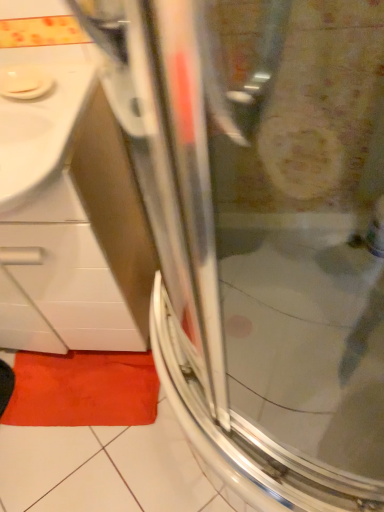
In order to click on orange fabric bath mat at lower left in this screenshot , I will do `click(83, 389)`.

What is the approximate height of orange fabric bath mat at lower left?

It is 1.93 inches.

Describe the element at coordinates (83, 389) in the screenshot. I see `orange fabric bath mat at lower left` at that location.

Describe the element at coordinates (39, 113) in the screenshot. Image resolution: width=384 pixels, height=512 pixels. I see `white glossy sink at upper left` at that location.

This screenshot has height=512, width=384. Identify the location of white glossy sink at upper left. (39, 113).

From the picture: In order to face white glossy sink at upper left, should I rotate leftwards or rightwards?

To face it directly, rotate left by 23.871 degrees.

Where is `orange fabric bath mat at lower left`? orange fabric bath mat at lower left is located at coordinates pyautogui.click(x=83, y=389).

Considering the relative positions of orange fabric bath mat at lower left and white glossy sink at upper left in the image provided, is orange fabric bath mat at lower left to the left or to the right of white glossy sink at upper left?

orange fabric bath mat at lower left is to the right of white glossy sink at upper left.

Is orange fabric bath mat at lower left in front of white glossy sink at upper left?

No, orange fabric bath mat at lower left is further to the viewer.

Is point (49, 393) behind point (58, 133)?

Yes, point (49, 393) is farther from viewer.

From the image's perspective, does orange fabric bath mat at lower left appear higher than white glossy sink at upper left?

No, from the image's perspective, orange fabric bath mat at lower left is not on top of white glossy sink at upper left.

From a real-world perspective, is orange fabric bath mat at lower left over white glossy sink at upper left?

No.

From the picture: Is orange fabric bath mat at lower left wider than white glossy sink at upper left?

In fact, orange fabric bath mat at lower left might be narrower than white glossy sink at upper left.

Between orange fabric bath mat at lower left and white glossy sink at upper left, which one has more height?

white glossy sink at upper left.

Which of these two, orange fabric bath mat at lower left or white glossy sink at upper left, is smaller?

Smaller between the two is orange fabric bath mat at lower left.

Consider the image. Is orange fabric bath mat at lower left spatially inside white glossy sink at upper left, or outside of it?

orange fabric bath mat at lower left exists outside the volume of white glossy sink at upper left.

Is orange fabric bath mat at lower left positioned far away from white glossy sink at upper left?

No.

In the scene shown: Is orange fabric bath mat at lower left facing away from white glossy sink at upper left?

No.

Can you tell me how much orange fabric bath mat at lower left and white glossy sink at upper left differ in facing direction?

4.72 degrees.

Image resolution: width=384 pixels, height=512 pixels. I want to click on sink above the orange fabric bath mat at lower left (from the image's perspective), so click(x=39, y=113).

Would you say white glossy sink at upper left is to the left or to the right of orange fabric bath mat at lower left in the picture?

Clearly, white glossy sink at upper left is on the left of orange fabric bath mat at lower left in the image.

In the scene shown: Between white glossy sink at upper left and orange fabric bath mat at lower left, which one is positioned behind?

orange fabric bath mat at lower left.

Considering the positions of points (53, 53) and (114, 408), is point (53, 53) closer to camera compared to point (114, 408)?

Yes, point (53, 53) is closer to viewer.

From the image's perspective, which is above, white glossy sink at upper left or orange fabric bath mat at lower left?

white glossy sink at upper left.

From a real-world perspective, relative to orange fabric bath mat at lower left, is white glossy sink at upper left vertically above or below?

From a real-world perspective, white glossy sink at upper left is physically above orange fabric bath mat at lower left.

Considering the sizes of objects white glossy sink at upper left and orange fabric bath mat at lower left in the image provided, who is wider, white glossy sink at upper left or orange fabric bath mat at lower left?

With larger width is white glossy sink at upper left.

Can you confirm if white glossy sink at upper left is shorter than orange fabric bath mat at lower left?

No, white glossy sink at upper left is not shorter than orange fabric bath mat at lower left.

Considering the relative sizes of white glossy sink at upper left and orange fabric bath mat at lower left in the image provided, is white glossy sink at upper left bigger than orange fabric bath mat at lower left?

Indeed, white glossy sink at upper left has a larger size compared to orange fabric bath mat at lower left.

Is white glossy sink at upper left situated inside orange fabric bath mat at lower left or outside?

white glossy sink at upper left lies outside orange fabric bath mat at lower left.

Is white glossy sink at upper left beside orange fabric bath mat at lower left?

No.

Could you tell me if white glossy sink at upper left is turned towards orange fabric bath mat at lower left?

No, white glossy sink at upper left does not turn towards orange fabric bath mat at lower left.

How many degrees apart are the facing directions of white glossy sink at upper left and orange fabric bath mat at lower left?

4.72 degrees.

Find the location of a particular element. The width and height of the screenshot is (384, 512). bath mat on the right of white glossy sink at upper left is located at coordinates (83, 389).

At what (x,y) coordinates should I click in order to perform the action: click on sink in front of the orange fabric bath mat at lower left. Please return your answer as a coordinate pair (x, y). Looking at the image, I should click on (39, 113).

At what (x,y) coordinates should I click in order to perform the action: click on sink above the orange fabric bath mat at lower left (from a real-world perspective). Please return your answer as a coordinate pair (x, y). The height and width of the screenshot is (512, 384). Looking at the image, I should click on (39, 113).